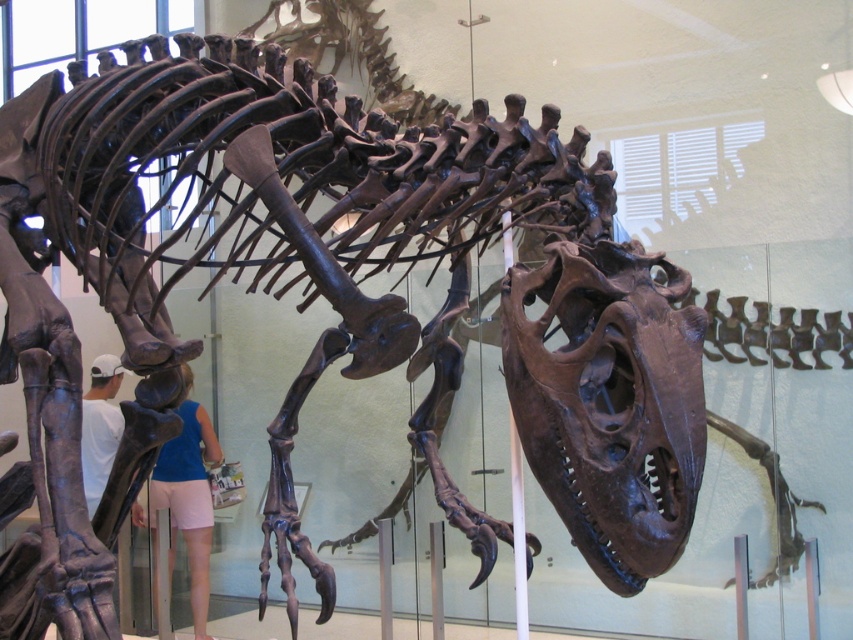
You are a visitor at the museum and want to take a photo of the T. rex skeleton. You notice the blue fabric shorts at lower center and the white matte shirt at lower left are blocking your view. Which object should you move to get a clear shot?

You should move the blue fabric shorts at lower center because it is in front of the white matte shirt at lower left, so removing the shorts would provide a clearer view of the T. rex skeleton.